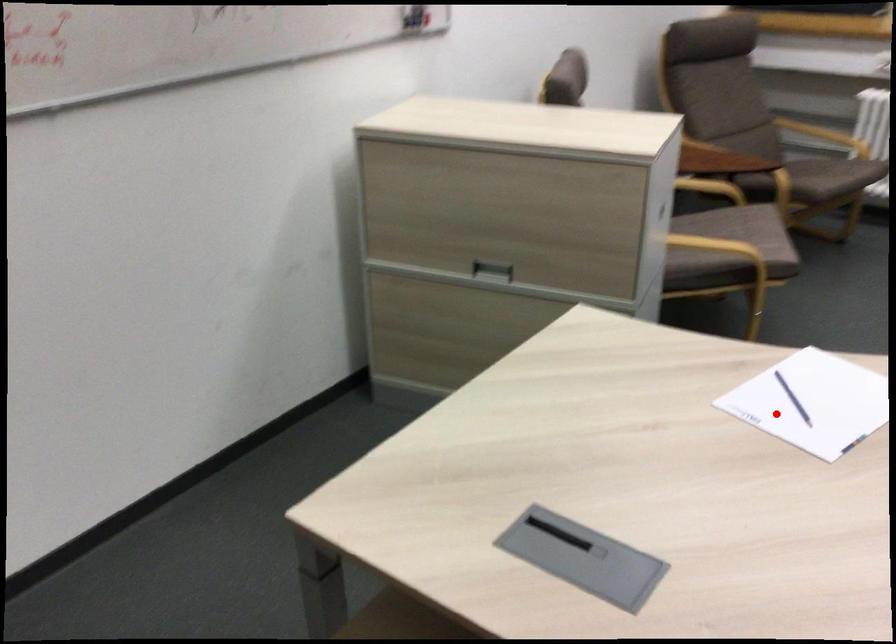
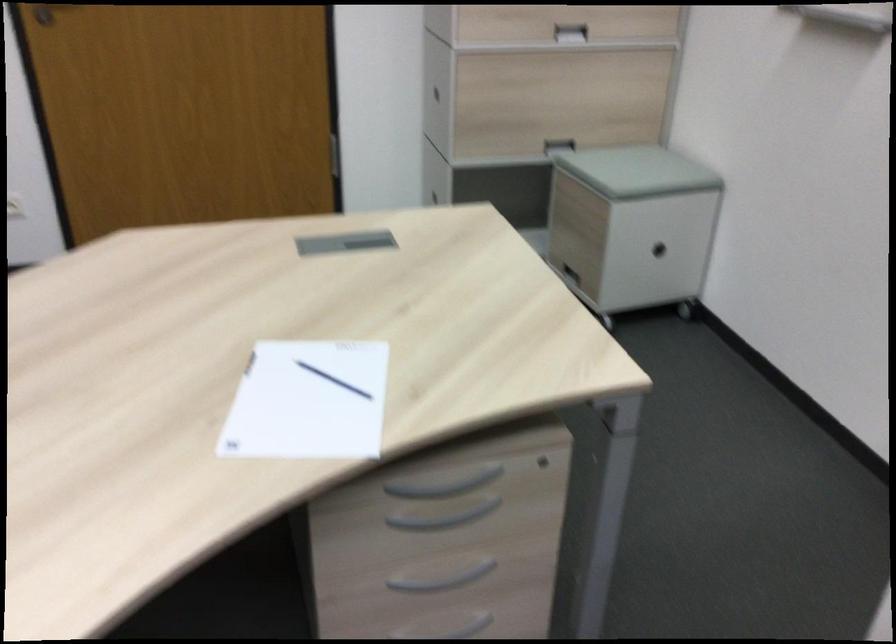
The point at the highlighted location is marked in the first image. Where is the corresponding point in the second image?

(333, 380)